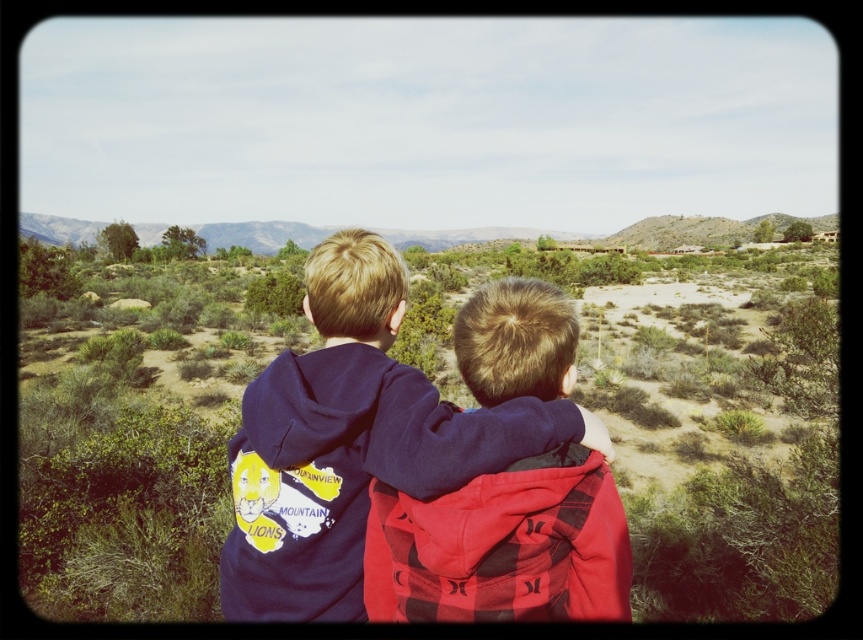
You are a photographer trying to capture the two points in the image. The first point is at position point (594, 563) and the second point is at point (319, 586). Which point is closer to the camera?

Point (594, 563) is in front of point (319, 586), so it is closer to the camera.

You are a photographer trying to capture a clear shot of the matte blue hoodie at center and the green shrubs at center. Based on their positions, which object should you focus on first to ensure both are in focus?

The matte blue hoodie at center is behind the green shrubs at center, so you should focus on the matte blue hoodie at center first to ensure both are in focus.

You are planning to place a small statue between the green shrubs at center and the matte blue hoodie at center. Based on their widths, which object should the statue be closer to?

The statue should be closer to the matte blue hoodie at center because its width is narrower than the green shrubs at center.